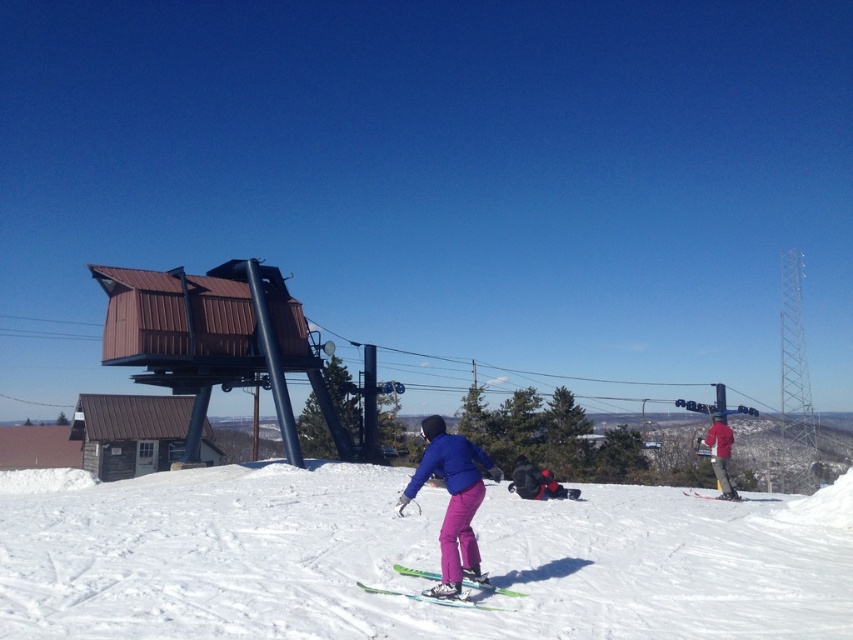
In the scene shown: You are a ski equipment inspector checking the width of the skis in the image. The green plastic ski at center and the matte black ski at right are both on the slope. According to the equipment standards, a ski must be at least 120 cm wide to be safe for beginners. Can you determine if either of these skis meets the requirement?

The green plastic ski at center might be wider than matte black ski at right. Since the green plastic ski at center is wider, it could potentially meet the 120 cm requirement, but without exact measurements, we can only confirm that the green plastic ski at center is wider than the matte black ski at right.

You are a photographer standing at the bottom of the slope. You want to take a photo that includes both the white powdery snow at center and the green plastic ski at center. Which object will appear larger in the photo?

The white powdery snow at center will appear larger in the photo because it is closer to the viewer than the green plastic ski at center.

You are a photographer trying to capture a photo of the matte blue jacket at center and the green plastic ski at center from the slope above. Which object should you aim your camera to the right of to include both in the frame?

You should aim your camera to the right of the matte blue jacket at center since it is positioned to the left of the green plastic ski at center, allowing both to be captured in the frame.